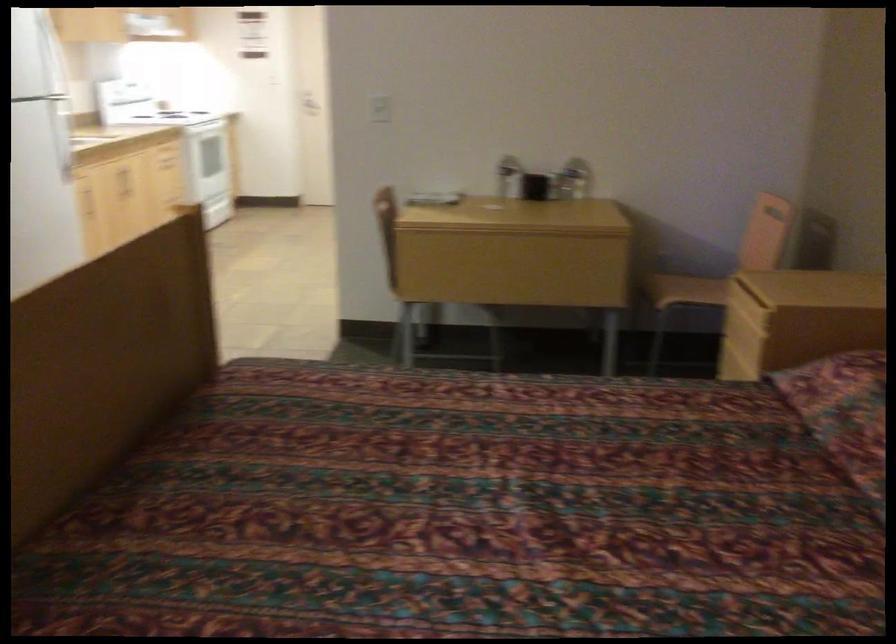
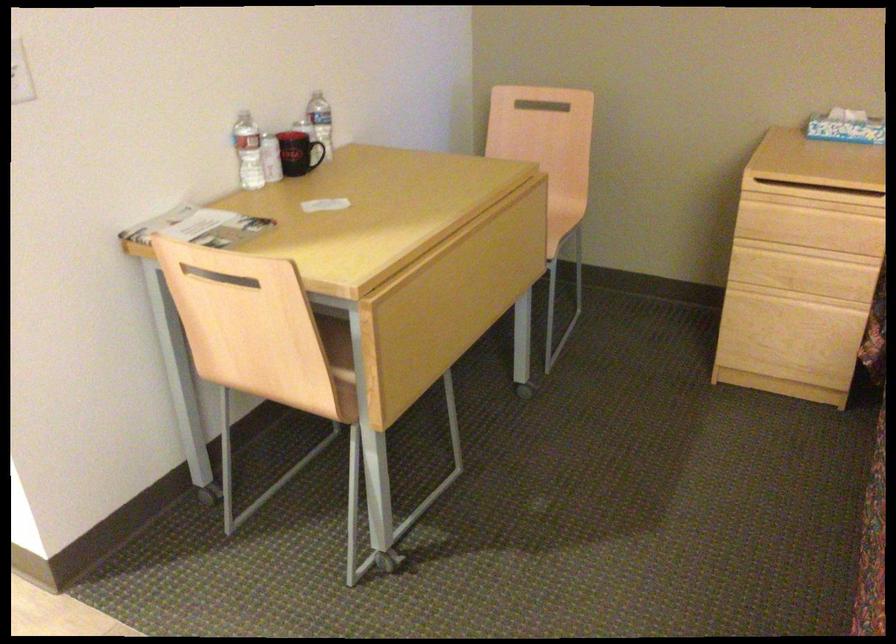
Question: I am providing you with two images of the same scene from different viewpoints. Which of the following objects are not visible in image2?

Choices:
 (A) plastic water bottle
 (B) drawer handle
 (C) black mug handle
 (D) none of these

Answer: (D)